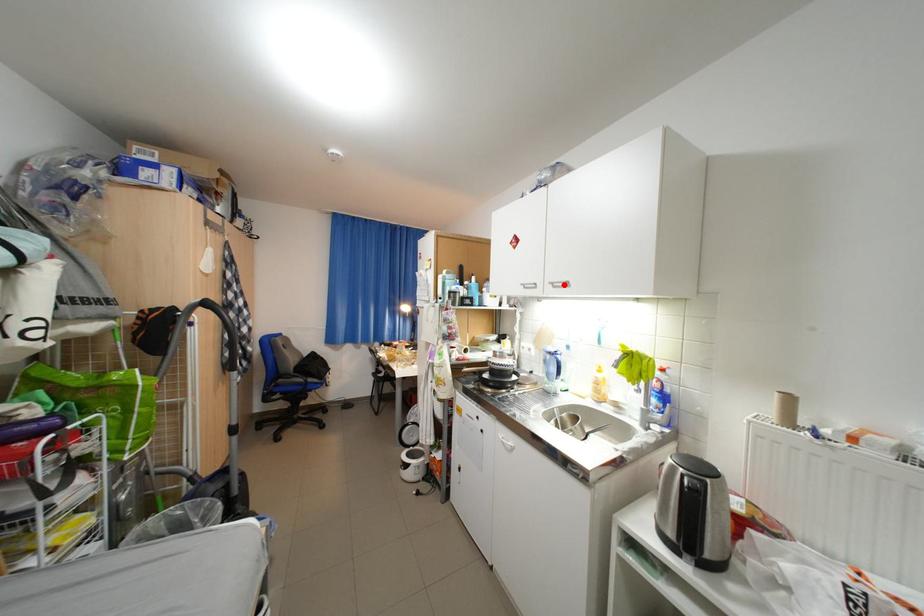
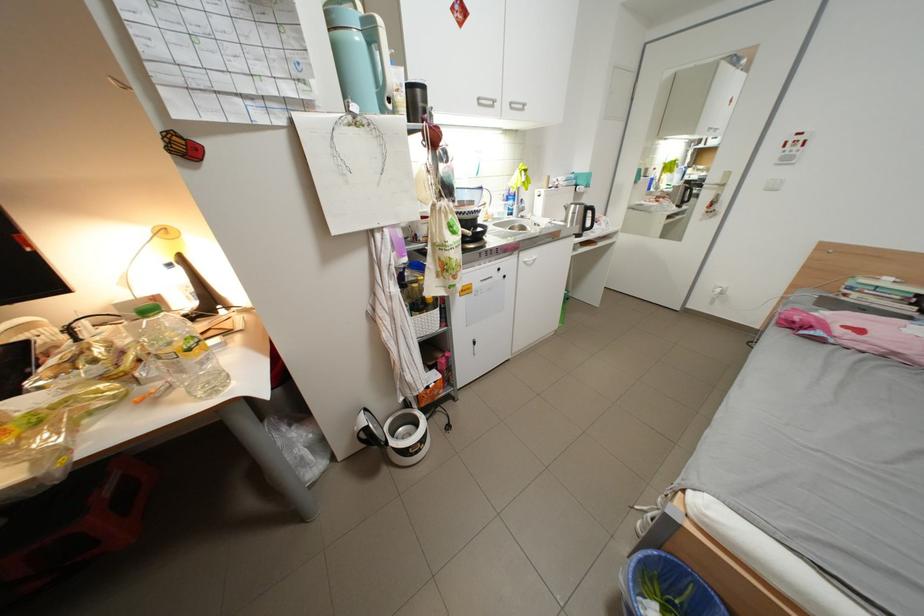
Where in the second image is the point corresponding to the highlighted location from the first image?

(523, 105)